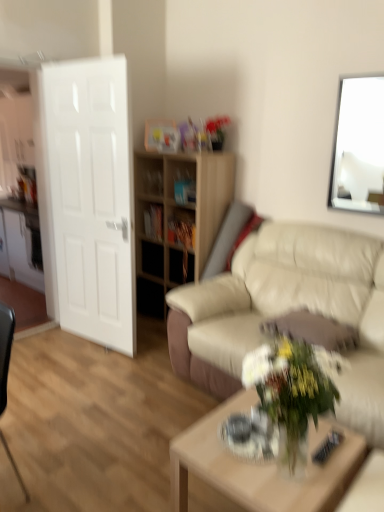
Where is `empty space that is ontop of light wood/texture coffee table at center`? This screenshot has width=384, height=512. empty space that is ontop of light wood/texture coffee table at center is located at coordinates (272, 451).